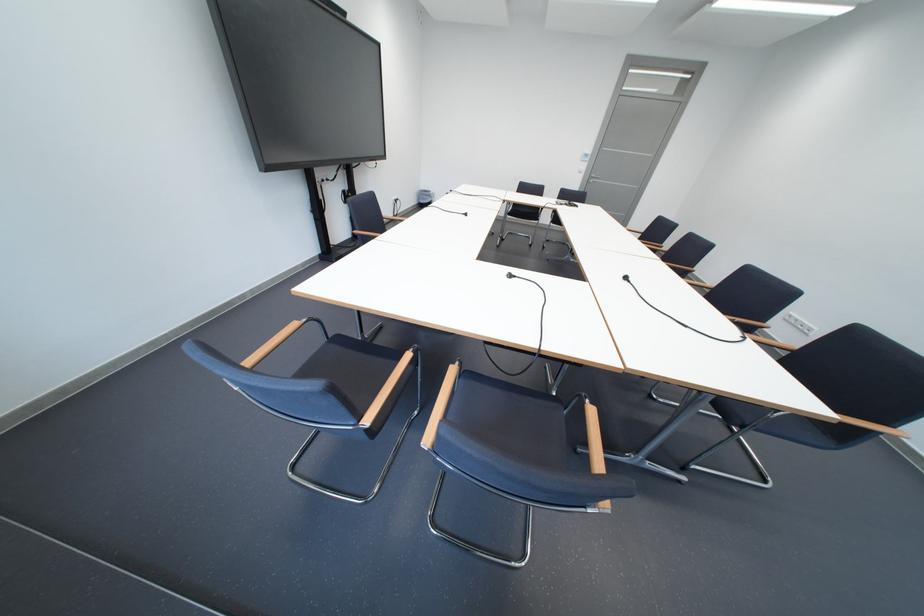
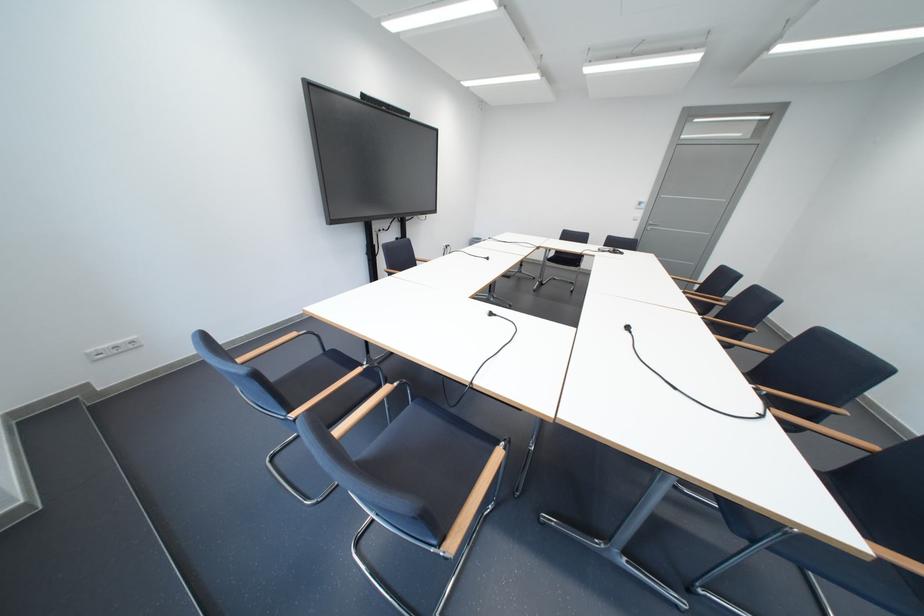
Question: The camera is either moving clockwise (left) or counter-clockwise (right) around the object. The first image is from the beginning of the video and the second image is from the end. Is the camera moving left or right when shooting the video?

Choices:
 (A) Left
 (B) Right

Answer: (B)